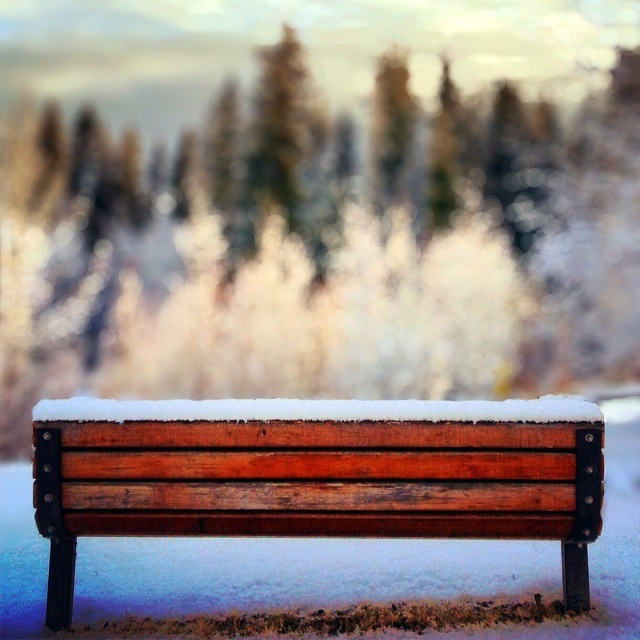
You are standing in front of the snowy bench and want to place two markers at the coordinates point (x=45, y=452) and point (x=419, y=401). Which marker will be closer to you?

Point (x=45, y=452) is closer to the viewer than point (x=419, y=401).

You are standing in a winter landscape and see the wooden bench at center and the white fluffy snow at center. Which object is taller?

The wooden bench at center is taller than the white fluffy snow at center.